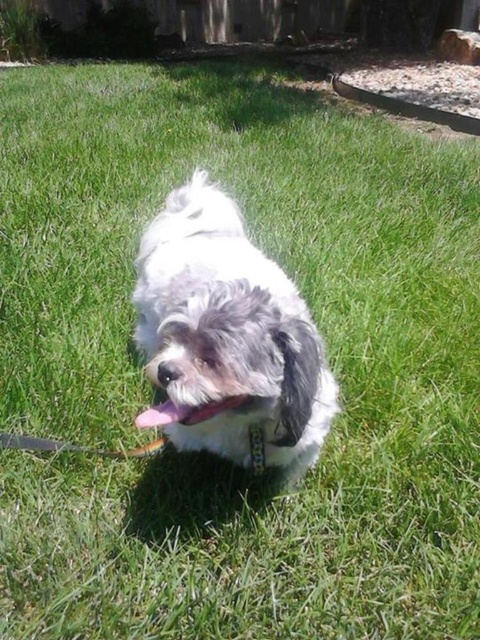
Question: Is white fluffy dog at center bigger than pink fabric mouth at center?

Choices:
 (A) yes
 (B) no

Answer: (A)

Question: Which object is positioned farthest from the pink fabric mouth at center?

Choices:
 (A) white fluffy dog at center
 (B) black fabric neckband at center

Answer: (A)

Question: Among these objects, which one is nearest to the camera?

Choices:
 (A) black fabric neckband at center
 (B) white fluffy dog at center

Answer: (B)

Question: Considering the real-world distances, which object is farthest from the pink fabric mouth at center?

Choices:
 (A) black fabric neckband at center
 (B) white fluffy dog at center

Answer: (B)

Question: Is white fluffy dog at center above pink fabric mouth at center?

Choices:
 (A) yes
 (B) no

Answer: (A)

Question: Can you confirm if white fluffy dog at center is positioned to the left of black fabric neckband at center?

Choices:
 (A) no
 (B) yes

Answer: (B)